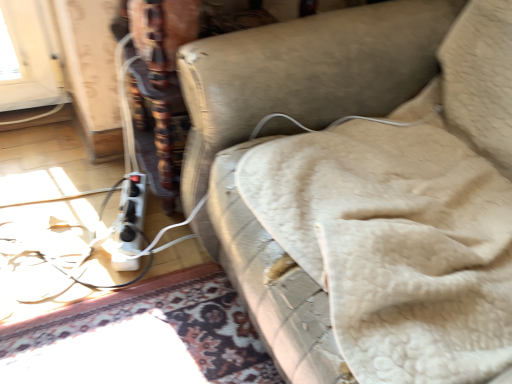
In order to click on leather couch at center in this screenshot , I will do `click(362, 187)`.

What do you see at coordinates (362, 187) in the screenshot? I see `leather couch at center` at bounding box center [362, 187].

Describe the element at coordinates (130, 223) in the screenshot. I see `white plastic extension cord at lower left` at that location.

Image resolution: width=512 pixels, height=384 pixels. I want to click on white plastic extension cord at lower left, so click(x=130, y=223).

Where is `leather couch at center`? leather couch at center is located at coordinates (362, 187).

Does leather couch at center appear on the left side of white plastic extension cord at lower left?

No.

Which is behind, leather couch at center or white plastic extension cord at lower left?

Positioned behind is white plastic extension cord at lower left.

Between point (320, 282) and point (142, 189), which one is positioned in front?

The point (320, 282) is closer.

Looking at this image, from the image's perspective, does leather couch at center appear lower than white plastic extension cord at lower left?

No, from the image's perspective, leather couch at center is not beneath white plastic extension cord at lower left.

From a real-world perspective, which object rests below the other?

white plastic extension cord at lower left, from a real-world perspective.

Is leather couch at center wider than white plastic extension cord at lower left?

Yes.

Does leather couch at center have a greater height compared to white plastic extension cord at lower left?

Yes, leather couch at center is taller than white plastic extension cord at lower left.

Considering the sizes of objects leather couch at center and white plastic extension cord at lower left in the image provided, who is bigger, leather couch at center or white plastic extension cord at lower left?

With larger size is leather couch at center.

Is leather couch at center located outside white plastic extension cord at lower left?

That's correct, leather couch at center is outside of white plastic extension cord at lower left.

Is leather couch at center with white plastic extension cord at lower left?

There is a gap between leather couch at center and white plastic extension cord at lower left.

Is leather couch at center aimed at white plastic extension cord at lower left?

No, leather couch at center does not turn towards white plastic extension cord at lower left.

What's the angular difference between leather couch at center and white plastic extension cord at lower left's facing directions?

There is a 19.8-degree angle between the facing directions of leather couch at center and white plastic extension cord at lower left.

How distant is leather couch at center from white plastic extension cord at lower left?

A distance of 54.32 centimeters exists between leather couch at center and white plastic extension cord at lower left.

The width and height of the screenshot is (512, 384). What are the coordinates of `furniture above the white plastic extension cord at lower left (from a real-world perspective)` in the screenshot? It's located at (362, 187).

Between white plastic extension cord at lower left and leather couch at center, which one appears on the left side from the viewer's perspective?

white plastic extension cord at lower left is more to the left.

Relative to leather couch at center, is white plastic extension cord at lower left in front or behind?

Clearly, white plastic extension cord at lower left is behind leather couch at center.

Is point (120, 205) behind point (478, 296)?

That is True.

From the image's perspective, which is below, white plastic extension cord at lower left or leather couch at center?

white plastic extension cord at lower left appears lower in the image.

From a real-world perspective, is white plastic extension cord at lower left physically above leather couch at center?

No, from a real-world perspective, white plastic extension cord at lower left is not on top of leather couch at center.

Based on the photo, is white plastic extension cord at lower left thinner than leather couch at center?

Indeed, white plastic extension cord at lower left has a lesser width compared to leather couch at center.

Is white plastic extension cord at lower left taller than leather couch at center?

No, white plastic extension cord at lower left is not taller than leather couch at center.

Considering the sizes of objects white plastic extension cord at lower left and leather couch at center in the image provided, who is bigger, white plastic extension cord at lower left or leather couch at center?

Bigger between the two is leather couch at center.

Is white plastic extension cord at lower left not inside leather couch at center?

Indeed, white plastic extension cord at lower left is completely outside leather couch at center.

Is white plastic extension cord at lower left far from leather couch at center?

white plastic extension cord at lower left is near leather couch at center, not far away.

Is white plastic extension cord at lower left oriented towards leather couch at center?

No, white plastic extension cord at lower left is not oriented towards leather couch at center.

How different are the orientations of white plastic extension cord at lower left and leather couch at center in degrees?

The facing directions of white plastic extension cord at lower left and leather couch at center are 19.8 degrees apart.

Find the location of a particular element. The image size is (512, 384). furniture above the white plastic extension cord at lower left (from a real-world perspective) is located at coordinates (362, 187).

Identify the location of furniture in front of the white plastic extension cord at lower left. This screenshot has width=512, height=384. (362, 187).

The image size is (512, 384). Identify the location of furniture that is above the white plastic extension cord at lower left (from the image's perspective). (362, 187).